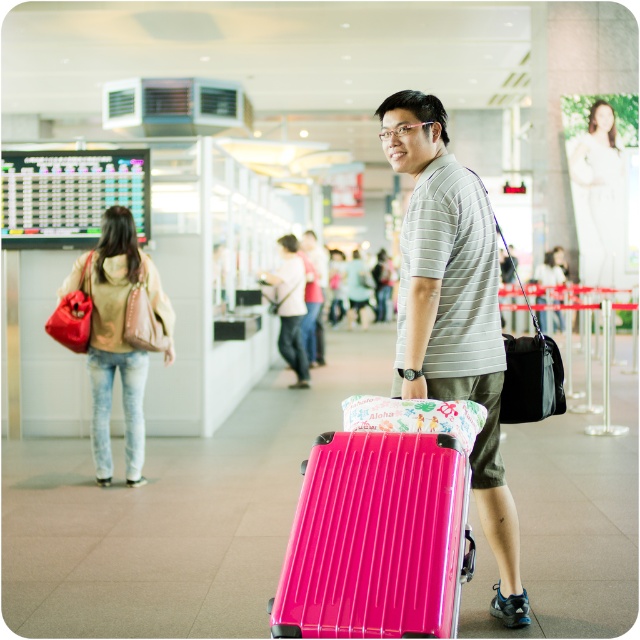
Question: Which point is closer to the camera taking this photo?

Choices:
 (A) (282, 563)
 (B) (612, 248)
 (C) (289, 268)
 (D) (134, 417)

Answer: (A)

Question: Among these points, which one is farthest from the camera?

Choices:
 (A) tap(468, 563)
 (B) tap(605, 276)
 (C) tap(444, 301)

Answer: (B)

Question: From the image, what is the correct spatial relationship of glossy plastic suitcase at lower center in relation to matte beige jacket at center?

Choices:
 (A) below
 (B) above

Answer: (A)

Question: Does matte beige hoodie at left appear on the right side of white matte dress at upper right?

Choices:
 (A) yes
 (B) no

Answer: (B)

Question: Which object is positioned closest to the white matte dress at upper right?

Choices:
 (A) matte gray shirt at center
 (B) glossy plastic suitcase at lower center
 (C) matte beige hoodie at left

Answer: (C)

Question: From the image, what is the correct spatial relationship of glossy plastic suitcase at lower center in relation to matte beige jacket at center?

Choices:
 (A) below
 (B) above

Answer: (A)